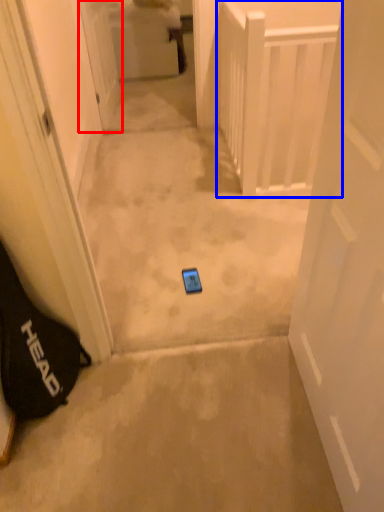
Question: Which object appears closest to the camera in this image, door (highlighted by a red box) or balustrade (highlighted by a blue box)?

Choices:
 (A) door
 (B) balustrade

Answer: (B)